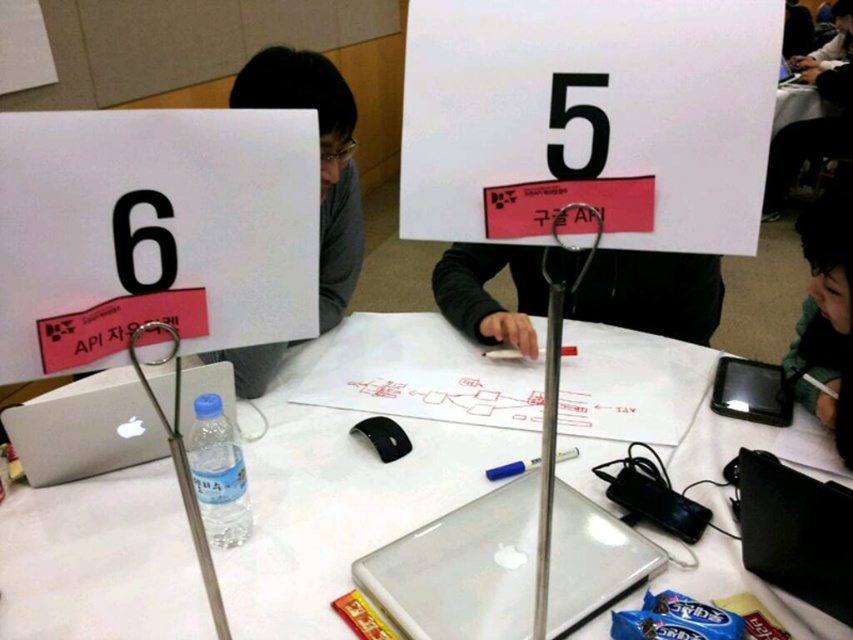
Question: Which of these objects is positioned closest to the sleek silver laptop at lower left?

Choices:
 (A) blue matte pen at center
 (B) black glossy laptop at lower right
 (C) black fabric face at lower right

Answer: (A)

Question: Which object is farther from the camera taking this photo?

Choices:
 (A) silver metallic laptop at center
 (B) white plastic table at center
 (C) black fabric shirt at upper right

Answer: (C)

Question: Can you confirm if silver metallic laptop at center is positioned below blue glossy pen at center?

Choices:
 (A) yes
 (B) no

Answer: (A)

Question: Which of the following is the farthest from the observer?

Choices:
 (A) black fabric face at lower right
 (B) matte gray shirt at center
 (C) black fabric shirt at upper right
 (D) white plastic table at center

Answer: (C)

Question: Does blue glossy pen at center have a lesser width compared to blue matte pen at center?

Choices:
 (A) yes
 (B) no

Answer: (A)

Question: Does matte gray shirt at center have a larger size compared to black glossy laptop at lower right?

Choices:
 (A) no
 (B) yes

Answer: (B)